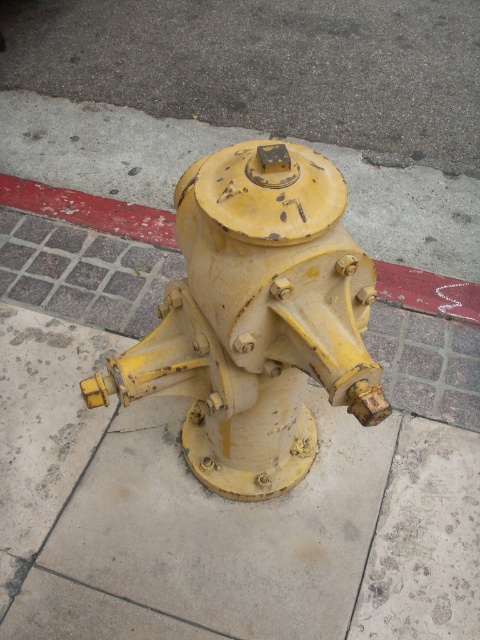
Does yellow matte hydrant at center appear over red painted concrete curb at lower center?

No.

Which is in front, point (243, 168) or point (379, 280)?

Positioned in front is point (243, 168).

The image size is (480, 640). I want to click on yellow matte hydrant at center, so click(256, 317).